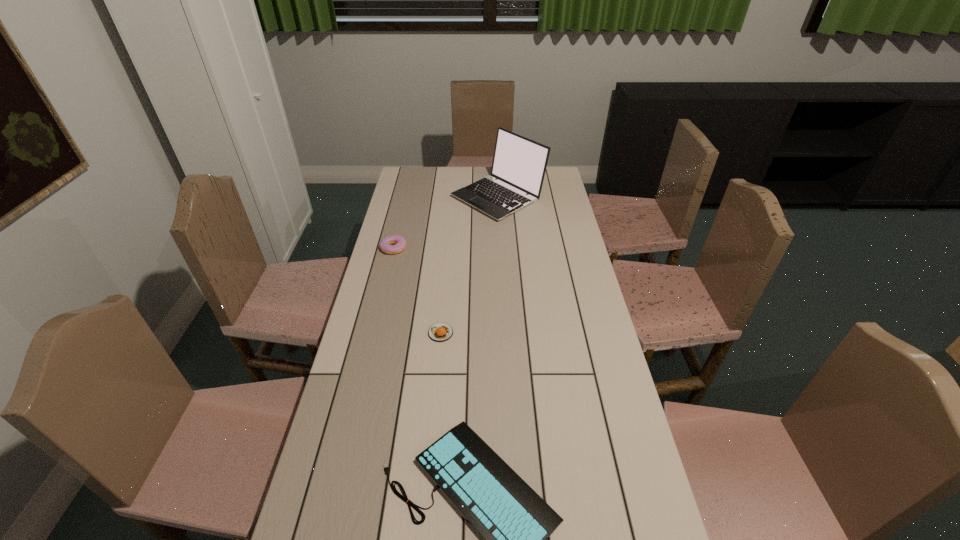
The image size is (960, 540). I want to click on free point between the second farthest object and the tallest object, so click(x=445, y=222).

Image resolution: width=960 pixels, height=540 pixels. I want to click on vacant area between the tallest object and the patty, so click(x=469, y=265).

You are a GUI agent. You are given a task and a screenshot of the screen. Output one action in this format:
    pyautogui.click(x=<x>, y=<y>)
    Task: Click on the empty space that is in between the third nearest object and the second shortest object
    This screenshot has width=960, height=540.
    Given the screenshot: What is the action you would take?
    pyautogui.click(x=418, y=291)

The image size is (960, 540). What are the coordinates of `vacant space in between the farthest object and the third shortest object` in the screenshot? It's located at (445, 222).

Locate an element on the screen. object that is the second closest to the leftmost object is located at coordinates (440, 332).

I want to click on the third closest object to the laptop_computer, so click(514, 522).

Locate an element on the screen. This screenshot has width=960, height=540. vacant region that satisfies the following two spatial constraints: 1. on the front side of the second nearest object; 2. on the right side of the leftmost object is located at coordinates 373,333.

The height and width of the screenshot is (540, 960). What are the coordinates of `vacant space that satisfies the following two spatial constraints: 1. at the front screen of the laptop_computer; 2. on the front side of the third tallest object` in the screenshot? It's located at (506, 333).

Locate an element on the screen. Image resolution: width=960 pixels, height=540 pixels. free location that satisfies the following two spatial constraints: 1. at the front screen of the tallest object; 2. on the front side of the leftmost object is located at coordinates (501, 248).